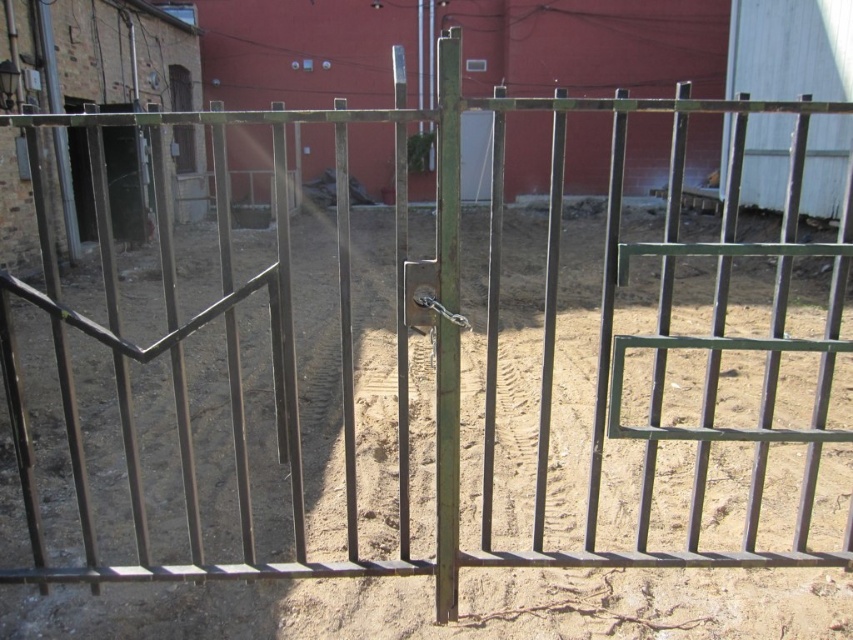
Question: Which object is positioned closest to the metallic silver door at center?

Choices:
 (A) metallic gate at left
 (B) wooden door at upper left

Answer: (B)

Question: Among these points, which one is nearest to the camera?

Choices:
 (A) (485, 145)
 (B) (184, 93)
 (C) (90, 209)

Answer: (C)

Question: Is the position of metallic silver door at center more distant than that of wooden door at upper left?

Choices:
 (A) yes
 (B) no

Answer: (A)

Question: Is metallic silver door at center thinner than metallic gate at left?

Choices:
 (A) yes
 (B) no

Answer: (B)

Question: Does metallic gate at left appear under wooden door at upper left?

Choices:
 (A) yes
 (B) no

Answer: (A)

Question: Which of the following is the farthest from the observer?

Choices:
 (A) (466, 131)
 (B) (74, 196)
 (C) (169, 77)

Answer: (A)